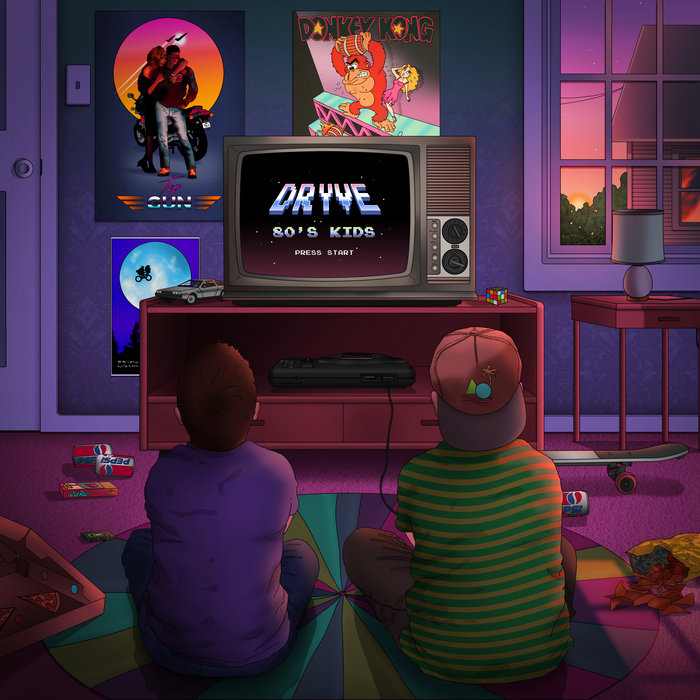
This screenshot has height=700, width=700. I want to click on lamp, so click(x=643, y=241).